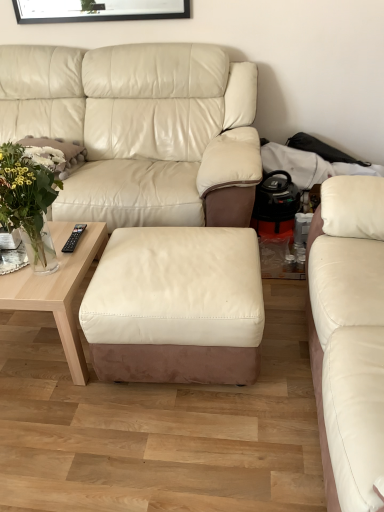
Question: Is translucent glass vase at upper left wider or thinner than light wood coffee table at lower left?

Choices:
 (A) thin
 (B) wide

Answer: (A)

Question: Is translucent glass vase at upper left bigger or smaller than light wood coffee table at lower left?

Choices:
 (A) small
 (B) big

Answer: (A)

Question: Estimate the real-world distances between objects in this image. Which object is farther from the white fluffy pillow at left?

Choices:
 (A) white leather ottoman at center
 (B) matte white leather couch at right, the 2th studio couch from the left
 (C) matte leather couch at center, the second studio couch positioned from the right
 (D) translucent glass vase at upper left
 (E) black matte picture frame at upper center

Answer: (B)

Question: Which object is positioned farthest from the matte leather couch at center, the second studio couch positioned from the right?

Choices:
 (A) translucent glass vase at upper left
 (B) white fluffy pillow at left
 (C) black matte picture frame at upper center
 (D) light wood coffee table at lower left
 (E) white leather ottoman at center

Answer: (A)